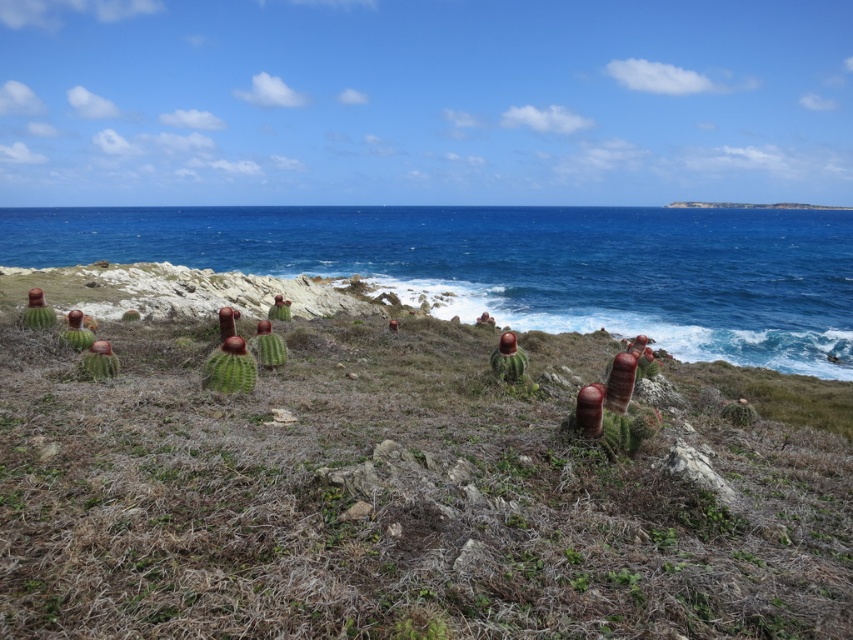
Question: Is green grassy at center above blue water at center?

Choices:
 (A) no
 (B) yes

Answer: (A)

Question: Does green grassy at center appear on the right side of blue water at center?

Choices:
 (A) no
 (B) yes

Answer: (A)

Question: In this image, where is green grassy at center located relative to blue water at center?

Choices:
 (A) left
 (B) right

Answer: (A)

Question: Among these points, which one is farthest from the camera?

Choices:
 (A) (733, 596)
 (B) (473, 314)

Answer: (B)

Question: Which point is closer to the camera?

Choices:
 (A) blue water at center
 (B) green grassy at center

Answer: (B)

Question: Which point is closer to the camera?

Choices:
 (A) blue water at center
 (B) green grassy at center

Answer: (B)